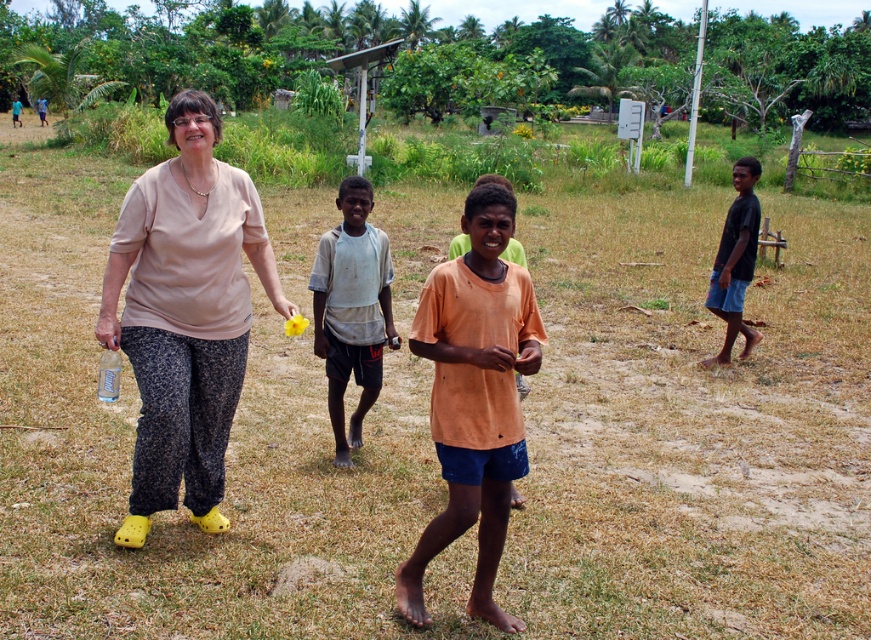
You are a photographer standing at the edge of the scene. You need to capture a photo that includes both the white cotton shirt at center and the dark blue shorts at right. What is the minimum distance you should set your camera lens to ensure both subjects are in frame?

The minimum distance you should set your camera lens is 13.40 feet to ensure both the white cotton shirt at center and the dark blue shorts at right are in frame.